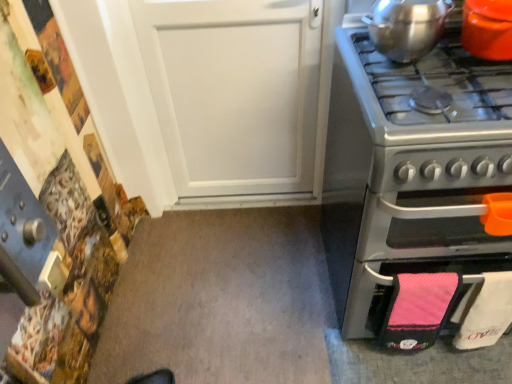
What do you see at coordinates (487, 29) in the screenshot? I see `orange glossy pot at upper right, which ranks as the second kitchen appliance in left-to-right order` at bounding box center [487, 29].

Identify the location of orange glossy pot at upper right, which ranks as the second kitchen appliance in left-to-right order. This screenshot has width=512, height=384. (487, 29).

Is the depth of orange glossy pot at upper right, which ranks as the second kitchen appliance in left-to-right order, less than that of shiny metallic pot at upper right, the first kitchen appliance positioned from the left?

Yes, the depth of orange glossy pot at upper right, which ranks as the second kitchen appliance in left-to-right order, is less than that of shiny metallic pot at upper right, the first kitchen appliance positioned from the left.

Considering the sizes of objects orange glossy pot at upper right, positioned as the 1th kitchen appliance in right-to-left order, and shiny metallic pot at upper right, the first kitchen appliance positioned from the left, in the image provided, who is taller, orange glossy pot at upper right, positioned as the 1th kitchen appliance in right-to-left order, or shiny metallic pot at upper right, the first kitchen appliance positioned from the left,?

orange glossy pot at upper right, positioned as the 1th kitchen appliance in right-to-left order.

Between orange glossy pot at upper right, which ranks as the second kitchen appliance in left-to-right order, and shiny metallic pot at upper right, positioned as the 2th kitchen appliance in right-to-left order, which one has smaller size?

With smaller size is orange glossy pot at upper right, which ranks as the second kitchen appliance in left-to-right order.

Measure the distance from stainless steel oven at right to shiny metallic pot at upper right, the first kitchen appliance positioned from the left.

A distance of 11.17 inches exists between stainless steel oven at right and shiny metallic pot at upper right, the first kitchen appliance positioned from the left.

Does stainless steel oven at right come in front of shiny metallic pot at upper right, the first kitchen appliance positioned from the left?

Yes, it is in front of shiny metallic pot at upper right, the first kitchen appliance positioned from the left.

Can you confirm if stainless steel oven at right is bigger than shiny metallic pot at upper right, the first kitchen appliance positioned from the left?

Indeed, stainless steel oven at right has a larger size compared to shiny metallic pot at upper right, the first kitchen appliance positioned from the left.

From the image's perspective, which is above, shiny metallic pot at upper right, positioned as the 2th kitchen appliance in right-to-left order, or orange glossy pot at upper right, which ranks as the second kitchen appliance in left-to-right order?

shiny metallic pot at upper right, positioned as the 2th kitchen appliance in right-to-left order, appears higher in the image.

Considering the relative sizes of shiny metallic pot at upper right, the first kitchen appliance positioned from the left, and orange glossy pot at upper right, positioned as the 1th kitchen appliance in right-to-left order, in the image provided, is shiny metallic pot at upper right, the first kitchen appliance positioned from the left, thinner than orange glossy pot at upper right, positioned as the 1th kitchen appliance in right-to-left order,?

Correct, the width of shiny metallic pot at upper right, the first kitchen appliance positioned from the left, is less than that of orange glossy pot at upper right, positioned as the 1th kitchen appliance in right-to-left order.

Is shiny metallic pot at upper right, the first kitchen appliance positioned from the left, positioned far away from orange glossy pot at upper right, positioned as the 1th kitchen appliance in right-to-left order?

They are positioned close to each other.

From their relative heights in the image, would you say shiny metallic pot at upper right, positioned as the 2th kitchen appliance in right-to-left order, is taller or shorter than orange glossy pot at upper right, which ranks as the second kitchen appliance in left-to-right order?

Considering their sizes, shiny metallic pot at upper right, positioned as the 2th kitchen appliance in right-to-left order, has less height than orange glossy pot at upper right, which ranks as the second kitchen appliance in left-to-right order.

Based on the photo, is stainless steel oven at right at the back of shiny metallic pot at upper right, the first kitchen appliance positioned from the left?

No, shiny metallic pot at upper right, the first kitchen appliance positioned from the left, is not facing away from stainless steel oven at right.

Which of these two, shiny metallic pot at upper right, the first kitchen appliance positioned from the left, or stainless steel oven at right, is thinner?

Thinner between the two is shiny metallic pot at upper right, the first kitchen appliance positioned from the left.

Is shiny metallic pot at upper right, the first kitchen appliance positioned from the left, inside the boundaries of stainless steel oven at right, or outside?

shiny metallic pot at upper right, the first kitchen appliance positioned from the left, is outside stainless steel oven at right.

Can you confirm if stainless steel oven at right is wider than orange glossy pot at upper right, which ranks as the second kitchen appliance in left-to-right order?

Correct, the width of stainless steel oven at right exceeds that of orange glossy pot at upper right, which ranks as the second kitchen appliance in left-to-right order.

Looking at the image, does stainless steel oven at right seem bigger or smaller compared to orange glossy pot at upper right, which ranks as the second kitchen appliance in left-to-right order?

Clearly, stainless steel oven at right is larger in size than orange glossy pot at upper right, which ranks as the second kitchen appliance in left-to-right order.

From a real-world perspective, which object rests below the other?

stainless steel oven at right.

How different are the orientations of orange glossy pot at upper right, positioned as the 1th kitchen appliance in right-to-left order, and stainless steel oven at right in degrees?

The facing directions of orange glossy pot at upper right, positioned as the 1th kitchen appliance in right-to-left order, and stainless steel oven at right are 0.233 degrees apart.

Is orange glossy pot at upper right, positioned as the 1th kitchen appliance in right-to-left order, to the left or to the right of stainless steel oven at right in the image?

Based on their positions, orange glossy pot at upper right, positioned as the 1th kitchen appliance in right-to-left order, is located to the right of stainless steel oven at right.

Who is shorter, orange glossy pot at upper right, positioned as the 1th kitchen appliance in right-to-left order, or stainless steel oven at right?

With less height is orange glossy pot at upper right, positioned as the 1th kitchen appliance in right-to-left order.

Find the location of a particular element. kitchen appliance in front of the shiny metallic pot at upper right, the first kitchen appliance positioned from the left is located at coordinates (487, 29).

This screenshot has width=512, height=384. In order to click on oven located underneath the shiny metallic pot at upper right, positioned as the 2th kitchen appliance in right-to-left order (from a real-world perspective) in this screenshot , I will do `click(426, 169)`.

Based on their spatial positions, is shiny metallic pot at upper right, positioned as the 2th kitchen appliance in right-to-left order, or orange glossy pot at upper right, which ranks as the second kitchen appliance in left-to-right order, further from stainless steel oven at right?

Based on the image, orange glossy pot at upper right, which ranks as the second kitchen appliance in left-to-right order, appears to be further to stainless steel oven at right.

Estimate the real-world distances between objects in this image. Which object is closer to shiny metallic pot at upper right, the first kitchen appliance positioned from the left, stainless steel oven at right or orange glossy pot at upper right, positioned as the 1th kitchen appliance in right-to-left order?

orange glossy pot at upper right, positioned as the 1th kitchen appliance in right-to-left order.

In the scene shown: When comparing their distances from orange glossy pot at upper right, positioned as the 1th kitchen appliance in right-to-left order, does stainless steel oven at right or shiny metallic pot at upper right, the first kitchen appliance positioned from the left, seem further?

stainless steel oven at right lies further to orange glossy pot at upper right, positioned as the 1th kitchen appliance in right-to-left order, than the other object.

Looking at the image, which one is located further to shiny metallic pot at upper right, the first kitchen appliance positioned from the left, orange glossy pot at upper right, which ranks as the second kitchen appliance in left-to-right order, or stainless steel oven at right?

stainless steel oven at right.

Estimate the real-world distances between objects in this image. Which object is further from stainless steel oven at right, orange glossy pot at upper right, which ranks as the second kitchen appliance in left-to-right order, or shiny metallic pot at upper right, the first kitchen appliance positioned from the left?

Based on the image, orange glossy pot at upper right, which ranks as the second kitchen appliance in left-to-right order, appears to be further to stainless steel oven at right.

From the image, which object appears to be farther from orange glossy pot at upper right, positioned as the 1th kitchen appliance in right-to-left order, shiny metallic pot at upper right, positioned as the 2th kitchen appliance in right-to-left order, or stainless steel oven at right?

Based on the image, stainless steel oven at right appears to be further to orange glossy pot at upper right, positioned as the 1th kitchen appliance in right-to-left order.

Where is `kitchen appliance between shiny metallic pot at upper right, the first kitchen appliance positioned from the left, and stainless steel oven at right, in the vertical direction`? kitchen appliance between shiny metallic pot at upper right, the first kitchen appliance positioned from the left, and stainless steel oven at right, in the vertical direction is located at coordinates (487, 29).